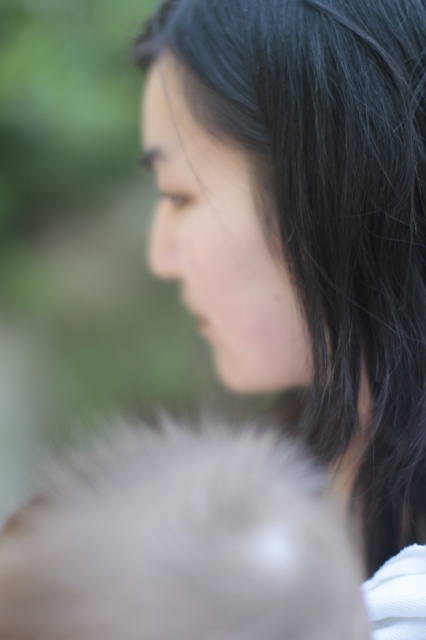
Question: Where is black silky hair at center located in relation to fuzzy white fur at lower left in the image?

Choices:
 (A) above
 (B) below

Answer: (A)

Question: Is black silky hair at center positioned behind fuzzy white fur at lower left?

Choices:
 (A) no
 (B) yes

Answer: (B)

Question: Which point is farther to the camera?

Choices:
 (A) (282, 54)
 (B) (282, 561)

Answer: (A)

Question: Can you confirm if black silky hair at center is positioned below fuzzy white fur at lower left?

Choices:
 (A) yes
 (B) no

Answer: (B)